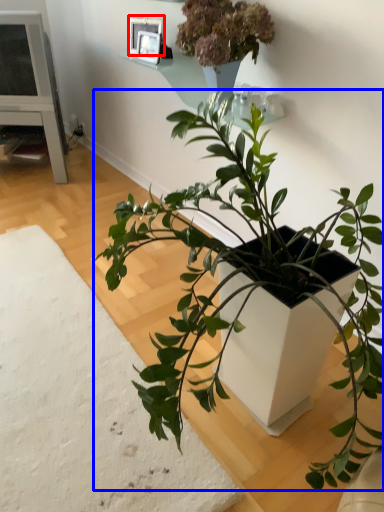
Question: Which object is closer to the camera taking this photo, picture frame (highlighted by a red box) or houseplant (highlighted by a blue box)?

Choices:
 (A) picture frame
 (B) houseplant

Answer: (B)